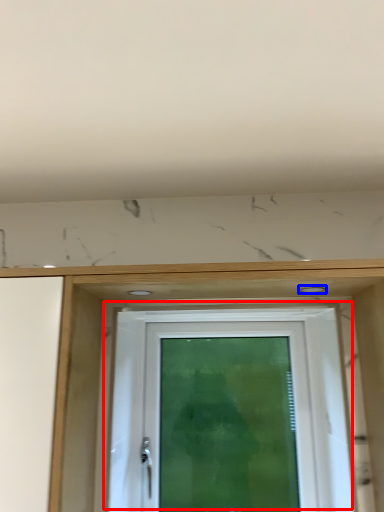
Question: Which of the following is the closest to the observer, door (highlighted by a red box) or hole (highlighted by a blue box)?

Choices:
 (A) door
 (B) hole

Answer: (B)